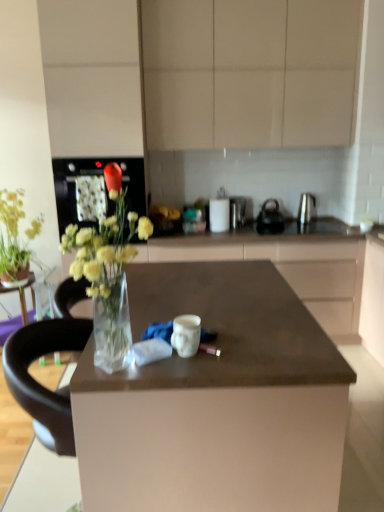
Find the location of a particular element. This screenshot has width=384, height=512. vacant space situated above matte brown countertop at center (from a real-world perspective) is located at coordinates (192, 298).